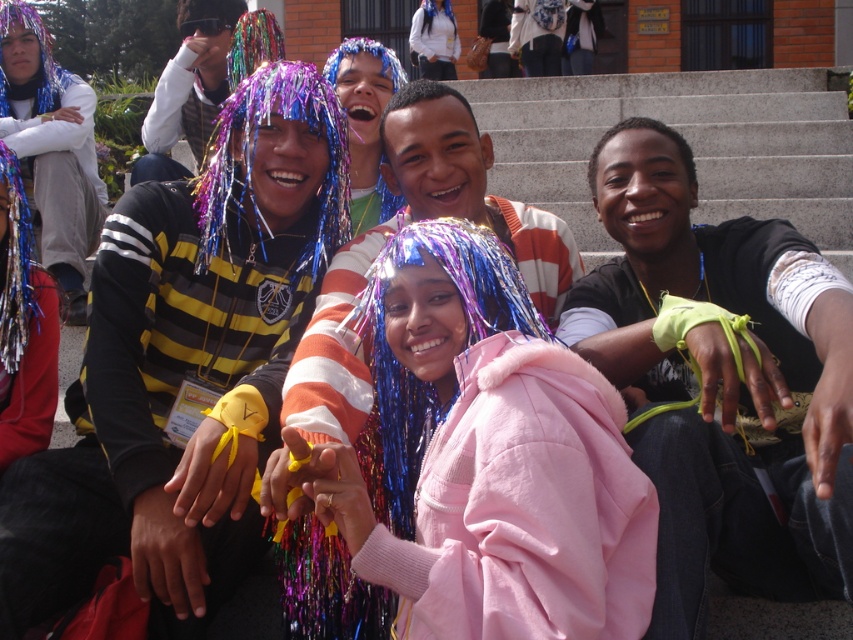
Question: Does pink fleece jacket at center appear under neon green fabric at center?

Choices:
 (A) no
 (B) yes

Answer: (B)

Question: Does pink fleece jacket at center appear under neon green fabric at center?

Choices:
 (A) no
 (B) yes

Answer: (B)

Question: Considering the relative positions of pink fleece jacket at center and neon green fabric at center in the image provided, where is pink fleece jacket at center located with respect to neon green fabric at center?

Choices:
 (A) left
 (B) right

Answer: (A)

Question: Which object appears closest to the camera in this image?

Choices:
 (A) pink fleece jacket at center
 (B) neon green fabric at center

Answer: (A)

Question: Which of the following is the closest to the observer?

Choices:
 (A) pink fleece jacket at center
 (B) neon green fabric at center

Answer: (A)

Question: Which object appears farthest from the camera in this image?

Choices:
 (A) neon green fabric at center
 (B) pink fleece jacket at center

Answer: (A)